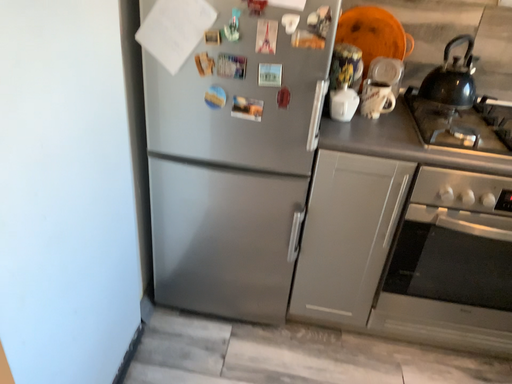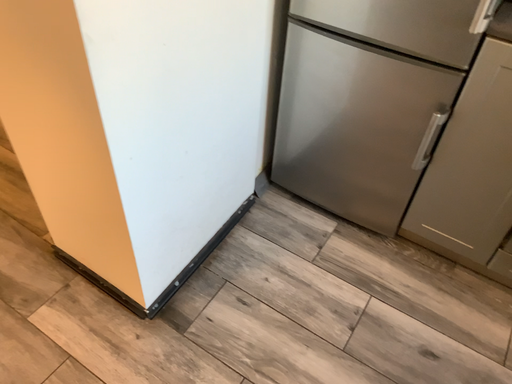
Question: Which way did the camera rotate in the video?

Choices:
 (A) rotated left
 (B) rotated right

Answer: (A)